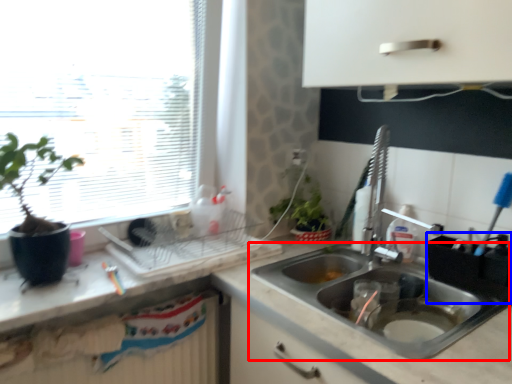
Question: Which object appears farthest to the camera in this image, sink (highlighted by a red box) or appliance (highlighted by a blue box)?

Choices:
 (A) sink
 (B) appliance

Answer: (B)